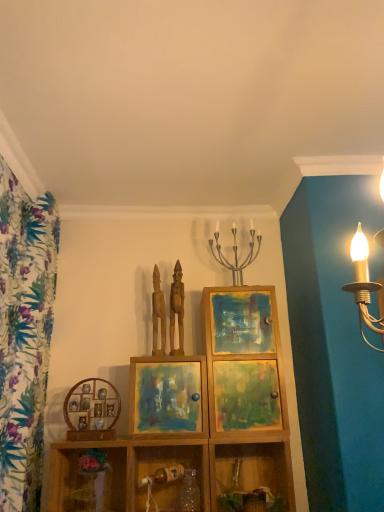
Question: Is there a large distance between wooden statue at center, the 2th sculpture when ordered from left to right, and metallic candle holder at center?

Choices:
 (A) yes
 (B) no

Answer: (B)

Question: From a real-world perspective, is wooden statue at center, the 2th sculpture when ordered from left to right, physically above metallic candle holder at center?

Choices:
 (A) no
 (B) yes

Answer: (A)

Question: Is wooden statue at center, the 2th sculpture when ordered from left to right, further to the viewer compared to metallic candle holder at center?

Choices:
 (A) yes
 (B) no

Answer: (A)

Question: Is wooden statue at center, which appears as the 1th sculpture when viewed from the right, to the left of metallic candle holder at center from the viewer's perspective?

Choices:
 (A) no
 (B) yes

Answer: (B)

Question: Considering the relative positions of wooden statue at center, the 2th sculpture when ordered from left to right, and metallic candle holder at center in the image provided, is wooden statue at center, the 2th sculpture when ordered from left to right, to the right of metallic candle holder at center from the viewer's perspective?

Choices:
 (A) yes
 (B) no

Answer: (B)

Question: From the image's perspective, is metallic candle holder at center located above or below wooden cabinet at center?

Choices:
 (A) above
 (B) below

Answer: (A)

Question: From a real-world perspective, is metallic candle holder at center physically located above or below wooden cabinet at center?

Choices:
 (A) below
 (B) above

Answer: (B)

Question: From their relative heights in the image, would you say metallic candle holder at center is taller or shorter than wooden cabinet at center?

Choices:
 (A) tall
 (B) short

Answer: (B)

Question: Is metallic candle holder at center wider or thinner than wooden cabinet at center?

Choices:
 (A) thin
 (B) wide

Answer: (A)

Question: Is matte wooden picture frame at center, the second picture frame when ordered from left to right, bigger or smaller than wooden shelf at lower right, which is the first shelf from right to left?

Choices:
 (A) small
 (B) big

Answer: (A)

Question: Is matte wooden picture frame at center, arranged as the 1th picture frame when viewed from the right, wider or thinner than wooden shelf at lower right, which is the fourth shelf in left-to-right order?

Choices:
 (A) thin
 (B) wide

Answer: (A)

Question: Considering their positions, is matte wooden picture frame at center, arranged as the 1th picture frame when viewed from the right, located in front of or behind wooden shelf at lower right, which is the fourth shelf in left-to-right order?

Choices:
 (A) front
 (B) behind

Answer: (B)

Question: Does point (203, 423) appear closer or farther from the camera than point (218, 493)?

Choices:
 (A) farther
 (B) closer

Answer: (B)

Question: From a real-world perspective, relative to matte wooden picture frame at center, arranged as the 1th picture frame when viewed from the right, is wooden statue at center, acting as the first sculpture starting from the left, vertically above or below?

Choices:
 (A) above
 (B) below

Answer: (A)

Question: In the image, is wooden statue at center, placed as the second sculpture when sorted from right to left, positioned in front of or behind matte wooden picture frame at center, arranged as the 1th picture frame when viewed from the right?

Choices:
 (A) behind
 (B) front

Answer: (A)